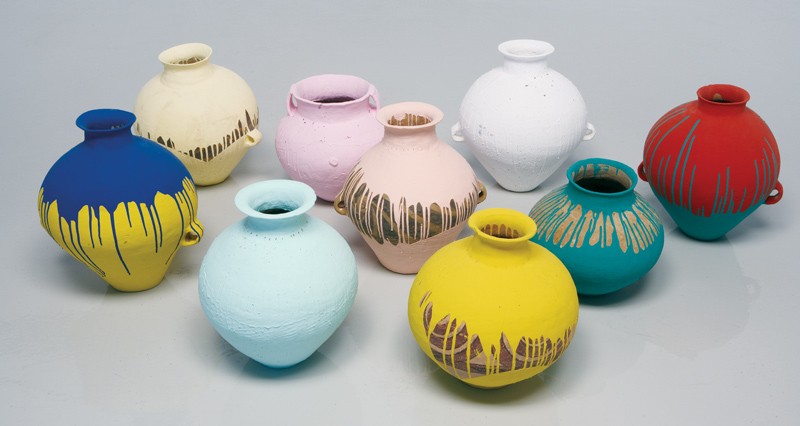
You are a GUI agent. You are given a task and a screenshot of the screen. Output one action in this format:
    pyautogui.click(x=<x>, y=<y>)
    Task: Click on the vase
    Image resolution: width=800 pixels, height=426 pixels.
    Given the screenshot: What is the action you would take?
    pyautogui.click(x=609, y=234)